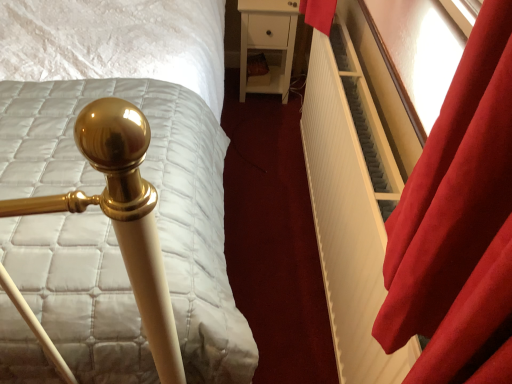
Image resolution: width=512 pixels, height=384 pixels. Describe the element at coordinates (459, 224) in the screenshot. I see `velvet red curtain at right` at that location.

Where is `white matte nightstand at center`? Image resolution: width=512 pixels, height=384 pixels. white matte nightstand at center is located at coordinates (268, 43).

Find the location of a particular element. The height and width of the screenshot is (384, 512). gold polished bedpost at left is located at coordinates (150, 144).

Consider the image. From a real-world perspective, is gold polished bedpost at left physically above white ribbed radiator at right?

Indeed, from a real-world perspective, gold polished bedpost at left stands above white ribbed radiator at right.

What's the angular difference between gold polished bedpost at left and white ribbed radiator at right's facing directions?

89.2 degrees separate the facing orientations of gold polished bedpost at left and white ribbed radiator at right.

Is gold polished bedpost at left spatially inside white ribbed radiator at right, or outside of it?

gold polished bedpost at left exists outside the volume of white ribbed radiator at right.

From the image's perspective, is gold polished bedpost at left below white ribbed radiator at right?

No, from the image's perspective, gold polished bedpost at left is not beneath white ribbed radiator at right.

How different are the orientations of white ribbed radiator at right and white matte nightstand at center in degrees?

They differ by 88.9 degrees in their facing directions.

Is white ribbed radiator at right looking in the opposite direction of white matte nightstand at center?

No, white ribbed radiator at right is not facing the opposite direction of white matte nightstand at center.

From the image's perspective, is white ribbed radiator at right beneath white matte nightstand at center?

Yes, from the image's perspective, white ribbed radiator at right is below white matte nightstand at center.

Which is less distant, (x=364, y=105) or (x=295, y=26)?

Point (x=364, y=105) is positioned closer to the camera compared to point (x=295, y=26).

Considering the positions of objects gold polished bedpost at left and velvet red curtain at right in the image provided, who is behind, gold polished bedpost at left or velvet red curtain at right?

velvet red curtain at right is further from the camera.

Does point (93, 381) appear closer or farther from the camera than point (420, 209)?

Clearly, point (93, 381) is more distant from the camera than point (420, 209).

Is gold polished bedpost at left surrounding velvet red curtain at right?

No, velvet red curtain at right is not inside gold polished bedpost at left.

Would you consider gold polished bedpost at left to be distant from velvet red curtain at right?

No, gold polished bedpost at left is not far away from velvet red curtain at right.

Can we say velvet red curtain at right lies outside gold polished bedpost at left?

Indeed, velvet red curtain at right is completely outside gold polished bedpost at left.

Between point (507, 210) and point (38, 353), which one is positioned behind?

Positioned behind is point (38, 353).

Is velvet red curtain at right positioned behind gold polished bedpost at left?

Yes, velvet red curtain at right is further from the viewer.

Considering the relative sizes of velvet red curtain at right and gold polished bedpost at left in the image provided, is velvet red curtain at right shorter than gold polished bedpost at left?

Indeed, velvet red curtain at right has a lesser height compared to gold polished bedpost at left.

Is gold polished bedpost at left a part of white ribbed radiator at right?

No, white ribbed radiator at right does not contain gold polished bedpost at left.

Does point (388, 381) appear closer or farther from the camera than point (67, 19)?

Point (388, 381) appears to be closer to the viewer than point (67, 19).

From a real-world perspective, which is physically below, white ribbed radiator at right or gold polished bedpost at left?

In real-world perspective, white ribbed radiator at right is lower.

Locate an element on the screen. This screenshot has width=512, height=384. radiator that appears on the right of gold polished bedpost at left is located at coordinates (350, 205).

At what (x,y) coordinates should I click in order to perform the action: click on bed located below the white matte nightstand at center (from the image's perspective). Please return your answer as a coordinate pair (x, y). This screenshot has height=384, width=512. Looking at the image, I should click on (150, 144).

Considering the positions of objects gold polished bedpost at left and white matte nightstand at center in the image provided, who is in front, gold polished bedpost at left or white matte nightstand at center?

gold polished bedpost at left is closer to the camera.

What's the angular difference between gold polished bedpost at left and white matte nightstand at center's facing directions?

gold polished bedpost at left and white matte nightstand at center are facing 0.316 degrees away from each other.

Can you confirm if velvet red curtain at right is thinner than white matte nightstand at center?

Correct, the width of velvet red curtain at right is less than that of white matte nightstand at center.

Does velvet red curtain at right come behind white matte nightstand at center?

No, it is in front of white matte nightstand at center.

From the image's perspective, is velvet red curtain at right positioned above or below white matte nightstand at center?

velvet red curtain at right is situated lower than white matte nightstand at center in the image.

You are a GUI agent. You are given a task and a screenshot of the screen. Output one action in this format:
    pyautogui.click(x=<x>, y=<y>)
    Task: Click on the curtain in front of the white matte nightstand at center
    This screenshot has width=512, height=384.
    Given the screenshot: What is the action you would take?
    pyautogui.click(x=459, y=224)

Where is `radiator that is on the right side of gold polished bedpost at left`? The image size is (512, 384). radiator that is on the right side of gold polished bedpost at left is located at coordinates (350, 205).

Find the location of a particular element. The width and height of the screenshot is (512, 384). furniture lying above the white ribbed radiator at right (from the image's perspective) is located at coordinates (268, 43).

Estimate the real-world distances between objects in this image. Which object is further from velvet red curtain at right, white matte nightstand at center or gold polished bedpost at left?

white matte nightstand at center.

When comparing their distances from velvet red curtain at right, does white matte nightstand at center or white ribbed radiator at right seem further?

white matte nightstand at center lies further to velvet red curtain at right than the other object.

Based on the photo, when comparing their distances from white ribbed radiator at right, does gold polished bedpost at left or white matte nightstand at center seem further?

white matte nightstand at center is positioned further to the anchor white ribbed radiator at right.

Based on their spatial positions, is velvet red curtain at right or gold polished bedpost at left closer to white ribbed radiator at right?

velvet red curtain at right.

Looking at the image, which one is located further to white ribbed radiator at right, velvet red curtain at right or white matte nightstand at center?

Based on the image, white matte nightstand at center appears to be further to white ribbed radiator at right.

Considering their positions, is white ribbed radiator at right positioned further to white matte nightstand at center than gold polished bedpost at left?

white ribbed radiator at right lies further to white matte nightstand at center than the other object.

Estimate the real-world distances between objects in this image. Which object is closer to white ribbed radiator at right, gold polished bedpost at left or velvet red curtain at right?

velvet red curtain at right is closer to white ribbed radiator at right.

Based on their spatial positions, is white matte nightstand at center or white ribbed radiator at right closer to gold polished bedpost at left?

Based on the image, white ribbed radiator at right appears to be nearer to gold polished bedpost at left.

Find the location of a particular element. The height and width of the screenshot is (384, 512). radiator located between gold polished bedpost at left and velvet red curtain at right in the left-right direction is located at coordinates (350, 205).

Locate an element on the screen. This screenshot has height=384, width=512. radiator positioned between velvet red curtain at right and white matte nightstand at center from near to far is located at coordinates (350, 205).

Image resolution: width=512 pixels, height=384 pixels. What are the coordinates of `radiator between gold polished bedpost at left and white matte nightstand at center in the front-back direction` in the screenshot? It's located at (350, 205).

What are the coordinates of `curtain between gold polished bedpost at left and white matte nightstand at center from front to back` in the screenshot? It's located at (x=459, y=224).